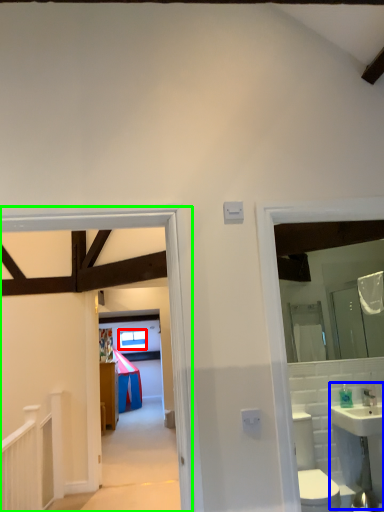
Question: Which is nearer to the window (highlighted by a red box)? sink (highlighted by a blue box) or corridor (highlighted by a green box).

Choices:
 (A) sink
 (B) corridor

Answer: (A)